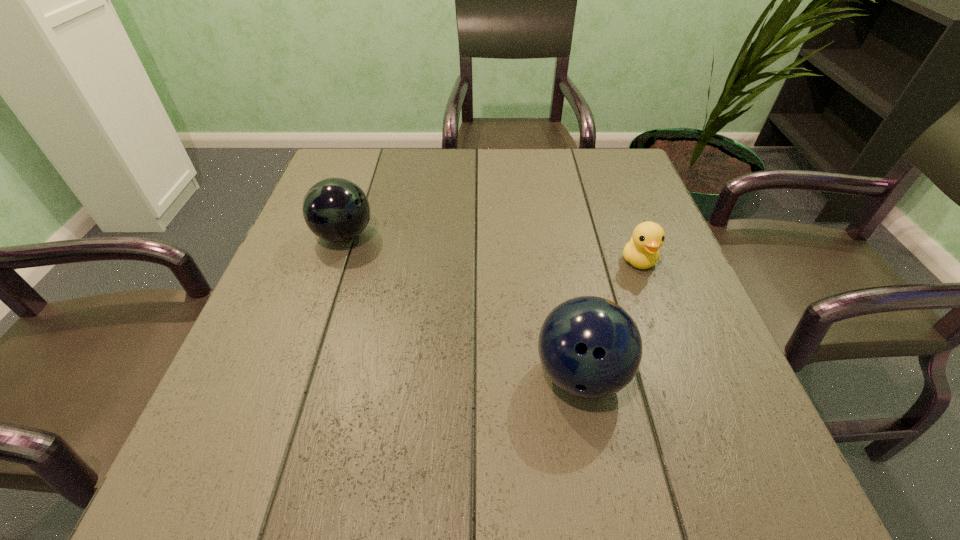
Locate an element on the screen. Image resolution: width=960 pixels, height=540 pixels. free space at the far edge of the desktop is located at coordinates (548, 155).

The height and width of the screenshot is (540, 960). Find the location of `vacant space at the left edge of the desktop`. vacant space at the left edge of the desktop is located at coordinates (333, 245).

In the image, there is a desktop. Where is `vacant space at the right edge`? The width and height of the screenshot is (960, 540). vacant space at the right edge is located at coordinates click(590, 220).

In the image, there is a desktop. Find the location of `free space at the far left corner`. free space at the far left corner is located at coordinates (352, 158).

At what (x,y) coordinates should I click in order to perform the action: click on free space at the far right corner of the desktop. Please return your answer as a coordinate pair (x, y). Looking at the image, I should click on (597, 165).

This screenshot has height=540, width=960. In the image, there is a desktop. What are the coordinates of `free space at the near right corner` in the screenshot? It's located at (729, 503).

You are a GUI agent. You are given a task and a screenshot of the screen. Output one action in this format:
    pyautogui.click(x=<x>, y=<y>)
    Task: Click on the empty location between the farther bowling ball and the shortest object
    
    Given the screenshot: What is the action you would take?
    pyautogui.click(x=492, y=248)

Identify the location of free space between the leftmost object and the second object from right to left. (463, 305).

You are a GUI agent. You are given a task and a screenshot of the screen. Output one action in this format:
    pyautogui.click(x=<x>, y=<y>)
    Task: Click on the vacant area that lies between the leftmost object and the right bowling ball
    Image resolution: width=960 pixels, height=540 pixels.
    Given the screenshot: What is the action you would take?
    pyautogui.click(x=463, y=305)

Identify the location of vacant area that lies between the leftmost object and the nearer bowling ball. This screenshot has height=540, width=960. (463, 305).